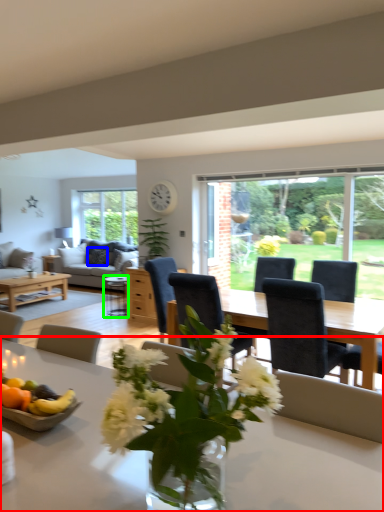
Question: Which is nearer to the table (highlighted by a red box)? pillow (highlighted by a blue box) or coffee table (highlighted by a green box).

Choices:
 (A) pillow
 (B) coffee table

Answer: (B)